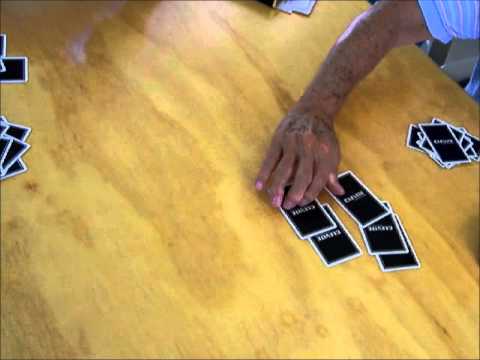
This screenshot has width=480, height=360. In order to click on gray wall in this screenshot , I will do `click(457, 58)`.